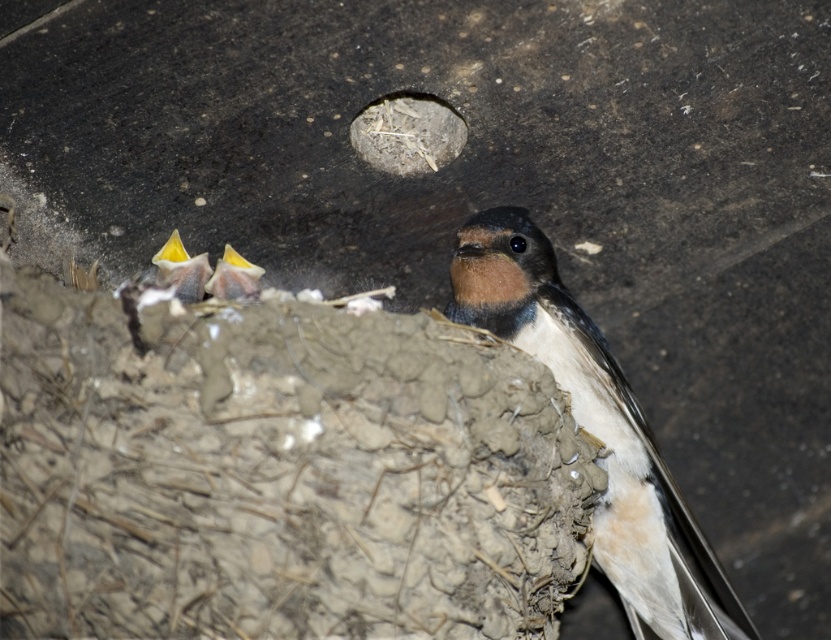
You are a birdwatcher observing the swallow family. You notice the brown feathered bird at center and the yellow beak at center. How far apart are these two features?

The brown feathered bird at center and the yellow beak at center are 25.84 inches apart from each other.

You are a birdwatcher holding a camera with a 100mm lens. The recommended focusing distance for this lens is between 15 to 30 inches. Can you capture a clear photo of the brown feathered bird at center and the yellow beak at left without adjusting your position?

The brown feathered bird at center is 26.91 inches away from the yellow beak at left. Since the distance falls within the recommended focusing range of 15 to 30 inches, you can capture a clear photo of both the brown feathered bird at center and the yellow beak at left without moving.